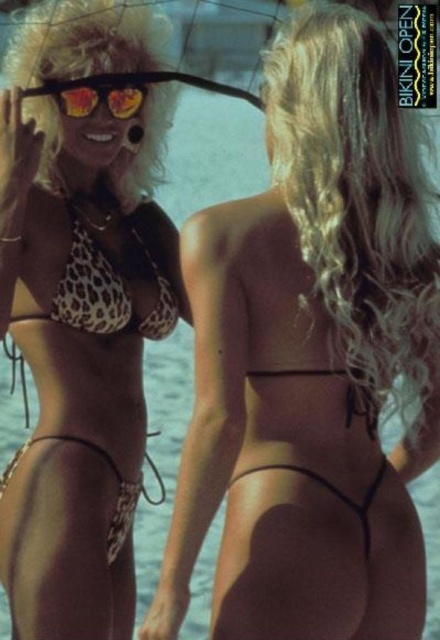
Who is positioned more to the left, leopard print bikini at left or shiny orange sunglasses at upper left?

From the viewer's perspective, leopard print bikini at left appears more on the left side.

This screenshot has height=640, width=440. What do you see at coordinates (81, 310) in the screenshot? I see `leopard print bikini at left` at bounding box center [81, 310].

I want to click on leopard print bikini at left, so click(81, 310).

Between point (392, 81) and point (99, 84), which one is positioned behind?

The point (99, 84) is more distant.

Is the position of matte black bikini bottom at right less distant than that of shiny orange sunglasses at upper left?

Yes, it is in front of shiny orange sunglasses at upper left.

Is point (387, 356) closer to viewer compared to point (99, 80)?

Yes, point (387, 356) is in front of point (99, 80).

I want to click on matte black bikini bottom at right, so click(x=359, y=211).

Which is more to the right, leopard print bikini bottom at center or leopard print bikini top at upper left?

Positioned to the right is leopard print bikini bottom at center.

Can you confirm if leopard print bikini bottom at center is positioned above leopard print bikini top at upper left?

No.

Does point (277, 253) lie behind point (99, 269)?

No, it is in front of (99, 269).

This screenshot has height=640, width=440. What are the coordinates of `leopard print bikini bottom at center` in the screenshot? It's located at (310, 360).